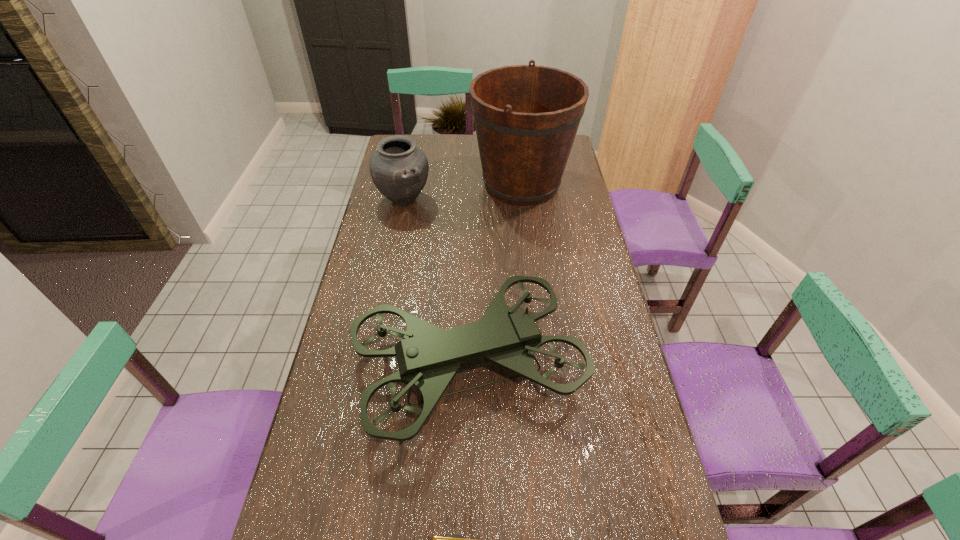
I want to click on bucket that is at the right edge, so click(x=526, y=117).

Where is `drone that is positioned at the right edge`? The width and height of the screenshot is (960, 540). drone that is positioned at the right edge is located at coordinates (428, 357).

Locate an element on the screen. This screenshot has height=540, width=960. object located in the far right corner section of the desktop is located at coordinates (526, 117).

Image resolution: width=960 pixels, height=540 pixels. Find the location of `vacant space at the far edge`. vacant space at the far edge is located at coordinates (426, 151).

The height and width of the screenshot is (540, 960). Identify the location of free location at the left edge of the desktop. (381, 243).

Find the location of a particular element. vacant space at the right edge of the desktop is located at coordinates (570, 227).

What are the coordinates of `free space between the third shortest object and the urn` in the screenshot? It's located at (437, 283).

At what (x,y) coordinates should I click in order to perform the action: click on vacant area that lies between the tallest object and the third tallest object. Please return your answer as a coordinate pair (x, y). The image size is (960, 540). Looking at the image, I should click on (463, 192).

This screenshot has width=960, height=540. I want to click on vacant area that lies between the third tallest object and the third farthest object, so click(437, 283).

You are a GUI agent. You are given a task and a screenshot of the screen. Output one action in this format:
    pyautogui.click(x=<x>, y=<y>)
    Task: Click on the unoccupied position between the tallest object and the second tallest object
    
    Given the screenshot: What is the action you would take?
    pyautogui.click(x=495, y=275)